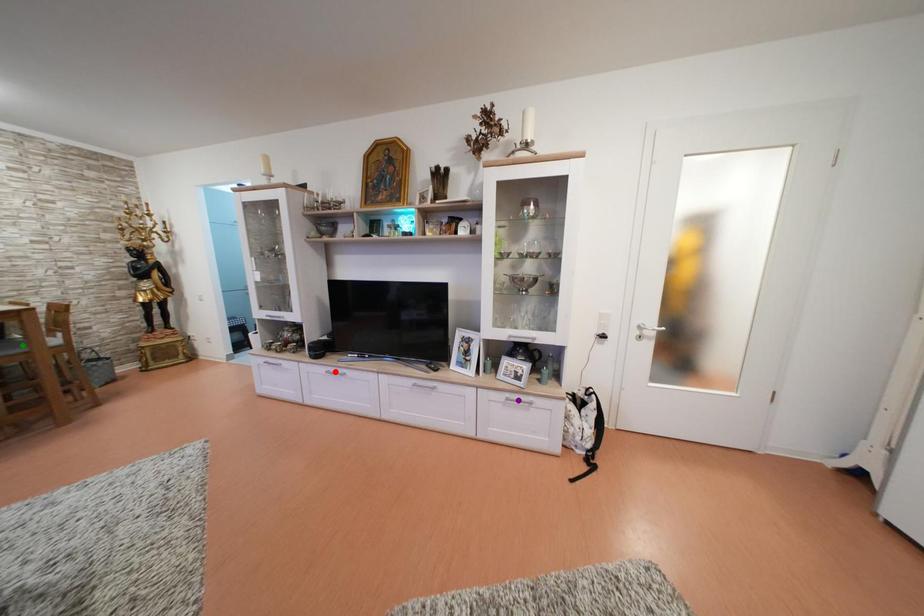
In the scene shown: Order these from nearest to farthest:
purple point
green point
red point

green point < purple point < red point